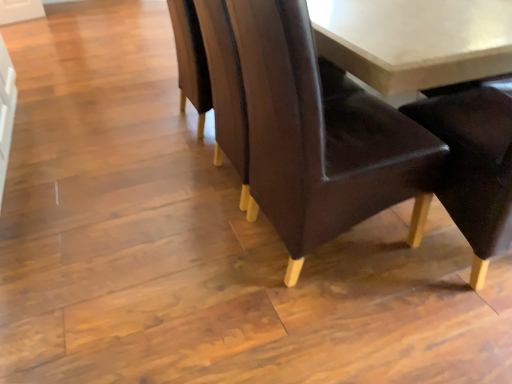
Question: Is smooth brown table at upper right at the back of matte brown leather chair at center?

Choices:
 (A) no
 (B) yes

Answer: (A)

Question: Considering the relative sizes of matte brown leather chair at center and smooth brown table at upper right in the image provided, is matte brown leather chair at center shorter than smooth brown table at upper right?

Choices:
 (A) no
 (B) yes

Answer: (A)

Question: Does matte brown leather chair at center turn towards smooth brown table at upper right?

Choices:
 (A) yes
 (B) no

Answer: (A)

Question: Can you confirm if matte brown leather chair at center is taller than smooth brown table at upper right?

Choices:
 (A) yes
 (B) no

Answer: (A)

Question: Is matte brown leather chair at center positioned behind smooth brown table at upper right?

Choices:
 (A) no
 (B) yes

Answer: (A)

Question: Is matte brown leather chair at center at the left side of smooth brown table at upper right?

Choices:
 (A) no
 (B) yes

Answer: (B)

Question: Is smooth brown table at upper right bigger than matte brown leather chair at center?

Choices:
 (A) yes
 (B) no

Answer: (B)

Question: Considering the relative positions of smooth brown table at upper right and matte brown leather chair at center in the image provided, is smooth brown table at upper right in front of matte brown leather chair at center?

Choices:
 (A) no
 (B) yes

Answer: (A)

Question: Can you confirm if smooth brown table at upper right is smaller than matte brown leather chair at center?

Choices:
 (A) yes
 (B) no

Answer: (A)

Question: Is smooth brown table at upper right facing away from matte brown leather chair at center?

Choices:
 (A) no
 (B) yes

Answer: (A)

Question: Is smooth brown table at upper right directly adjacent to matte brown leather chair at center?

Choices:
 (A) no
 (B) yes

Answer: (A)

Question: From the image's perspective, is smooth brown table at upper right on matte brown leather chair at center?

Choices:
 (A) no
 (B) yes

Answer: (A)

Question: Considering the positions of point (421, 13) and point (441, 142), is point (421, 13) closer or farther from the camera than point (441, 142)?

Choices:
 (A) closer
 (B) farther

Answer: (B)